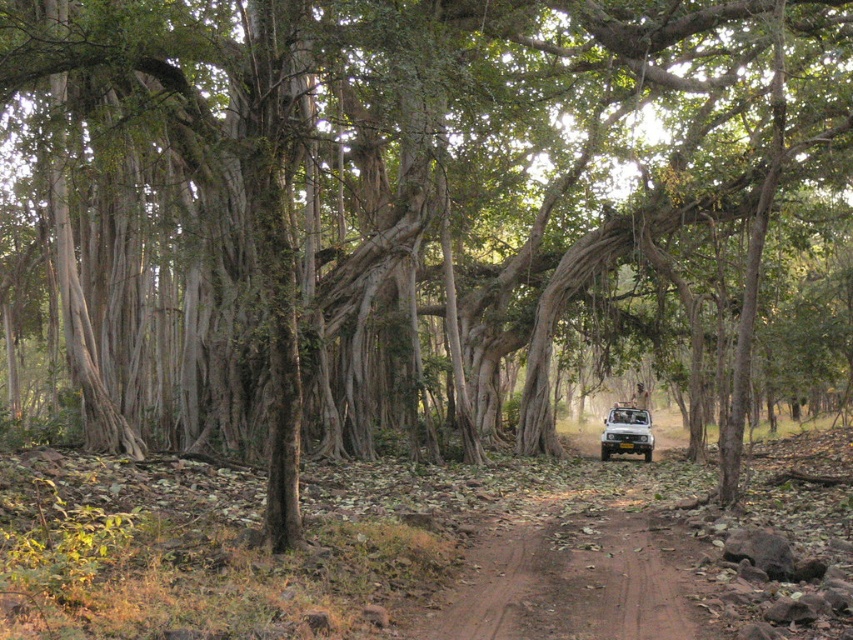
Does brown dirt track at center have a lesser width compared to yellow matte jeep at center?

Yes.

Between point (543, 577) and point (645, 460), which one is positioned behind?

The point (645, 460) is more distant.

Find the location of a particular element. The height and width of the screenshot is (640, 853). brown dirt track at center is located at coordinates (567, 582).

In order to click on brown dirt track at center in this screenshot , I will do `click(567, 582)`.